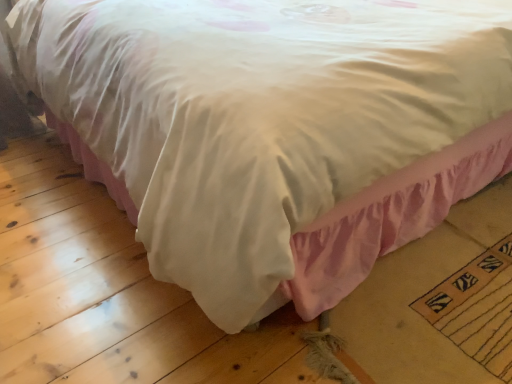
In order to click on free area behind yellow woven mat at lower right in this screenshot , I will do `click(468, 225)`.